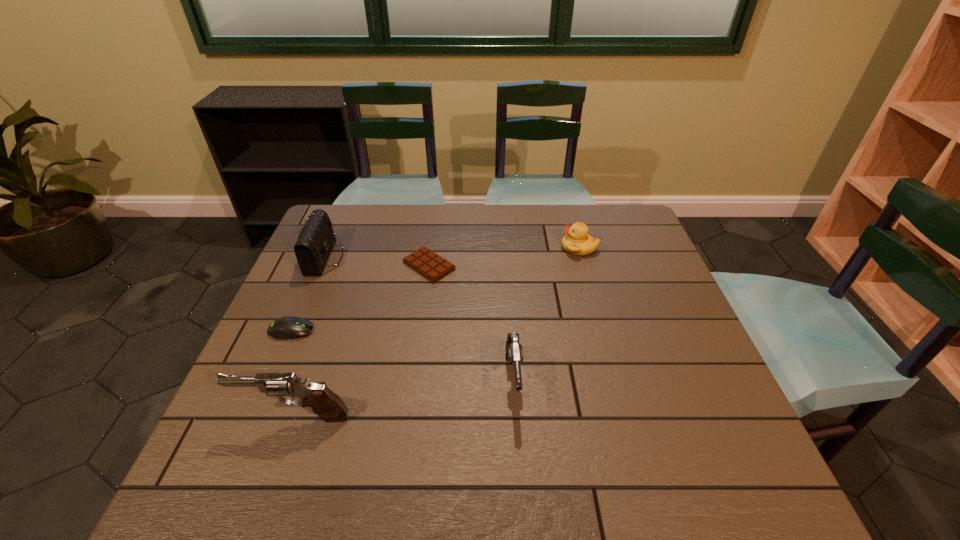
In order to click on the fifth closest object to the clutch bag in this screenshot , I will do `click(577, 241)`.

The height and width of the screenshot is (540, 960). Find the location of `object identified as the fourth closest to the computer mouse`. object identified as the fourth closest to the computer mouse is located at coordinates (514, 351).

The height and width of the screenshot is (540, 960). Identify the location of blank area in the image that satisfies the following two spatial constraints: 1. at the barrel of the right pistol; 2. at the barrel of the taller pistol. (516, 416).

You are a GUI agent. You are given a task and a screenshot of the screen. Output one action in this format:
    pyautogui.click(x=<x>, y=<y>)
    Task: Click on the vacant space that satisfies the following two spatial constraints: 1. on the front flap of the clutch bag; 2. on the back side of the fourth object from left to right
    The height and width of the screenshot is (540, 960).
    Given the screenshot: What is the action you would take?
    pyautogui.click(x=321, y=266)

You are a GUI agent. You are given a task and a screenshot of the screen. Output one action in this format:
    pyautogui.click(x=<x>, y=<y>)
    Task: Click on the vacant space that satisfies the following two spatial constraints: 1. on the front-facing side of the rightmost object; 2. at the barrel of the fifth object from left to right
    The image size is (960, 540).
    Given the screenshot: What is the action you would take?
    pyautogui.click(x=616, y=381)